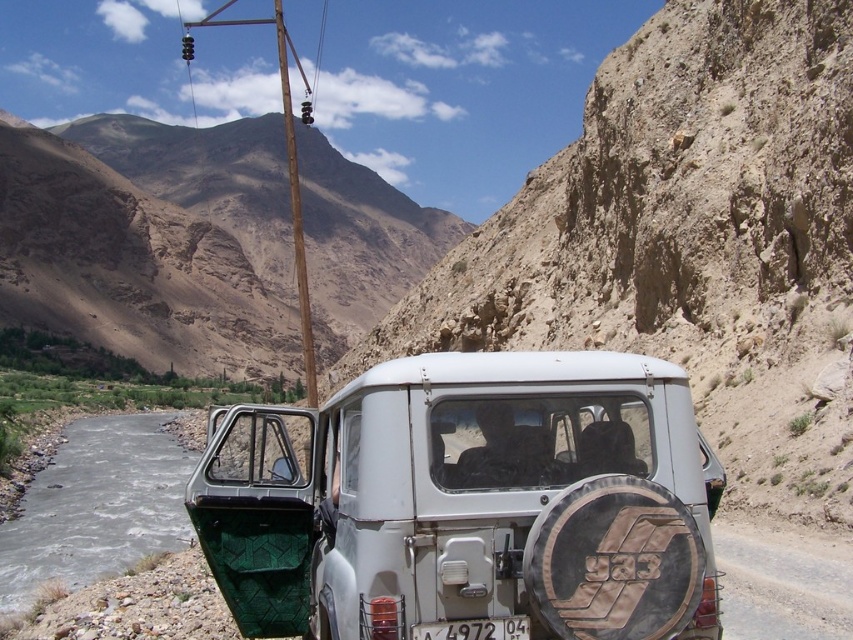
Question: Can you confirm if dull brown rock at center is positioned above dull brown rock at upper center?

Choices:
 (A) no
 (B) yes

Answer: (A)

Question: Which is nearer to the dull brown rock at center?

Choices:
 (A) dull brown rock at upper center
 (B) gray rocky river at lower left
 (C) white matte jeep at center
 (D) white plastic license plate at center

Answer: (C)

Question: Considering the relative positions of white matte jeep at center and dull brown rock at upper center in the image provided, where is white matte jeep at center located with respect to dull brown rock at upper center?

Choices:
 (A) below
 (B) above

Answer: (A)

Question: Does white matte jeep at center have a larger size compared to brown wooden telegraph pole at upper center?

Choices:
 (A) yes
 (B) no

Answer: (B)

Question: Among these points, which one is nearest to the camera?

Choices:
 (A) (285, 120)
 (B) (697, 579)
 (C) (73, 506)

Answer: (B)

Question: Estimate the real-world distances between objects in this image. Which object is closer to the white plastic license plate at center?

Choices:
 (A) gray rocky river at lower left
 (B) white matte jeep at center

Answer: (B)